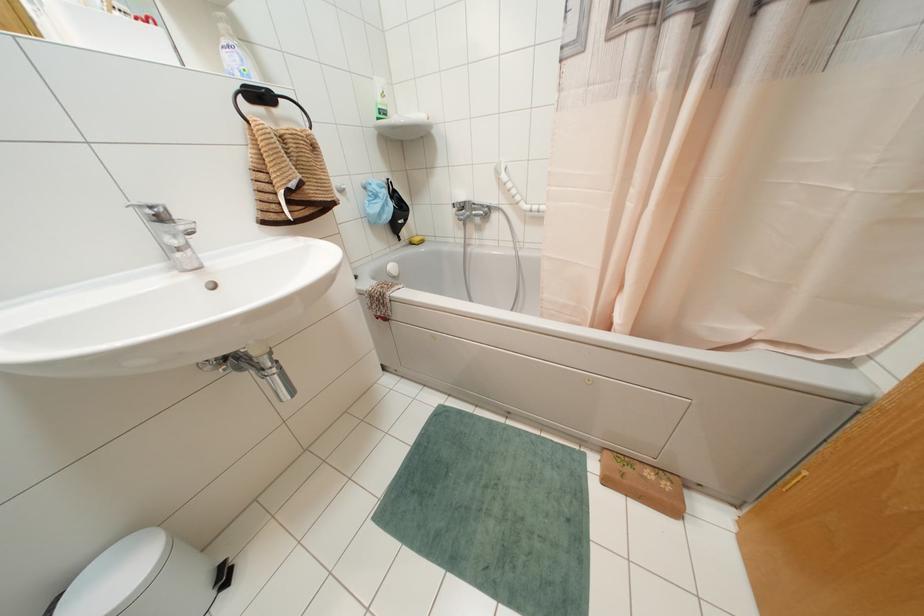
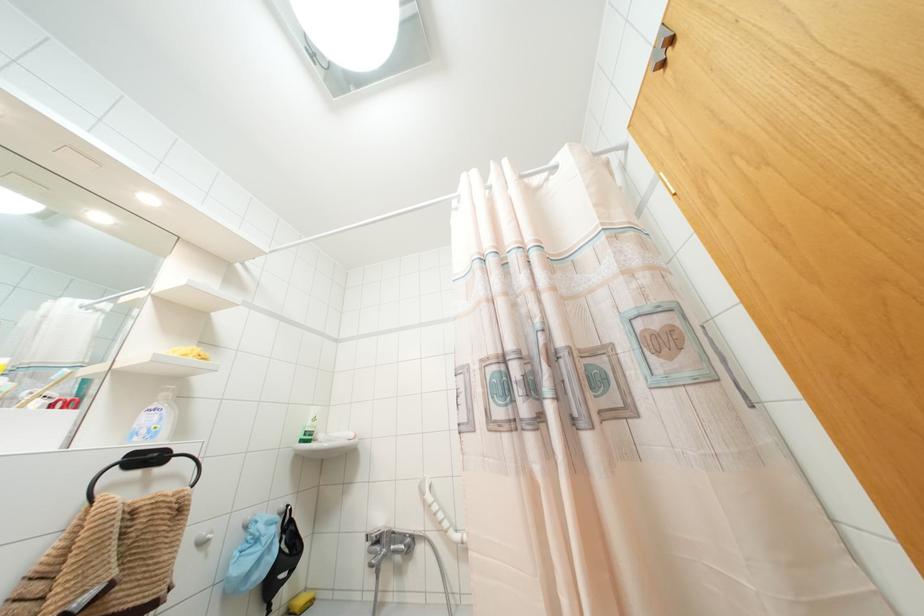
Where in the second image is the point corresponding to the point at 259,95 from the first image?

(147, 458)